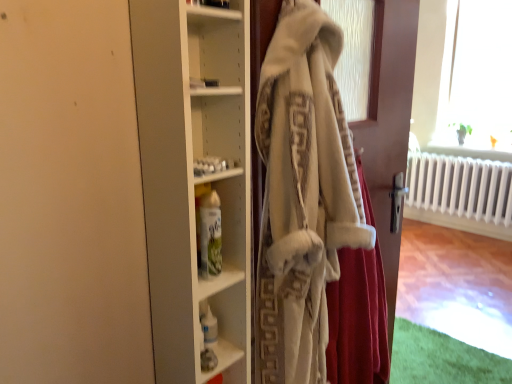
Find the location of `white fluffy bathrobe at center`. white fluffy bathrobe at center is located at coordinates (388, 123).

The width and height of the screenshot is (512, 384). Describe the element at coordinates (388, 123) in the screenshot. I see `white fluffy bathrobe at center` at that location.

Where is `white glossy spray can at center, marked as the 1th shelf in a top-to-bottom arrangement`? The width and height of the screenshot is (512, 384). white glossy spray can at center, marked as the 1th shelf in a top-to-bottom arrangement is located at coordinates (216, 239).

The height and width of the screenshot is (384, 512). I want to click on white matte cupboard at center, so click(194, 175).

Is white matte cupboard at center a part of white plastic bottle at lower center, which is the 1th shelf in back-to-front order?

Actually, white matte cupboard at center is outside white plastic bottle at lower center, which is the 1th shelf in back-to-front order.

From the image's perspective, is white plastic bottle at lower center, which is the 1th shelf in back-to-front order, positioned above or below white matte cupboard at center?

From the image's perspective, white plastic bottle at lower center, which is the 1th shelf in back-to-front order, appears below white matte cupboard at center.

Which is more to the left, white plastic bottle at lower center, which is the 1th shelf in back-to-front order, or white matte cupboard at center?

From the viewer's perspective, white matte cupboard at center appears more on the left side.

Considering the positions of objects white plastic bottle at lower center, which is the 1th shelf in back-to-front order, and white matte cupboard at center in the image provided, who is behind, white plastic bottle at lower center, which is the 1th shelf in back-to-front order, or white matte cupboard at center?

Positioned behind is white plastic bottle at lower center, which is the 1th shelf in back-to-front order.

Which of these two, white glossy spray can at center, marked as the 1th shelf in a top-to-bottom arrangement, or fuzzy white shawl at center, is thinner?

With smaller width is white glossy spray can at center, marked as the 1th shelf in a top-to-bottom arrangement.

Is white glossy spray can at center, positioned as the second shelf in back-to-front order, next to fuzzy white shawl at center?

No, white glossy spray can at center, positioned as the second shelf in back-to-front order, is not making contact with fuzzy white shawl at center.

Is white glossy spray can at center, positioned as the second shelf in back-to-front order, in front of or behind fuzzy white shawl at center in the image?

Clearly, white glossy spray can at center, positioned as the second shelf in back-to-front order, is behind fuzzy white shawl at center.

Between white matte cupboard at center and white plastic bottle at lower center, the 2th shelf positioned from the top, which one has larger width?

white matte cupboard at center.

Is white matte cupboard at center oriented towards white plastic bottle at lower center, which is the 1th shelf in back-to-front order?

No, white matte cupboard at center does not turn towards white plastic bottle at lower center, which is the 1th shelf in back-to-front order.

From a real-world perspective, does white matte cupboard at center sit lower than white plastic bottle at lower center, which is the 1th shelf from bottom to top?

Actually, white matte cupboard at center is physically above white plastic bottle at lower center, which is the 1th shelf from bottom to top, in the real world.

Based on the photo, can you tell me how much white matte cupboard at center and white plastic bottle at lower center, which is the second shelf in front-to-back order, differ in facing direction?

2.33 degrees.

Is the position of white plastic bottle at lower center, which is the second shelf in front-to-back order, more distant than that of white fluffy bathrobe at center?

Yes, it is behind white fluffy bathrobe at center.

Could you tell me if white plastic bottle at lower center, which is the second shelf in front-to-back order, is turned towards white fluffy bathrobe at center?

Yes, white plastic bottle at lower center, which is the second shelf in front-to-back order, is facing white fluffy bathrobe at center.

Can you confirm if white plastic bottle at lower center, the 2th shelf positioned from the top, is shorter than fuzzy white shawl at center?

Yes.

From a real-world perspective, is white plastic bottle at lower center, which is the second shelf in front-to-back order, below fuzzy white shawl at center?

Indeed, from a real-world perspective, white plastic bottle at lower center, which is the second shelf in front-to-back order, is positioned beneath fuzzy white shawl at center.

Considering the positions of points (208, 373) and (345, 252), is point (208, 373) closer to camera compared to point (345, 252)?

Yes, point (208, 373) is closer to viewer.

Could you tell me if white plastic bottle at lower center, which is the 1th shelf from bottom to top, is facing fuzzy white shawl at center?

No, white plastic bottle at lower center, which is the 1th shelf from bottom to top, is not facing towards fuzzy white shawl at center.

I want to click on shelf that is under the white glossy spray can at center, positioned as the second shelf in back-to-front order (from a real-world perspective), so click(222, 358).

From the picture: Considering the positions of objects white glossy spray can at center, marked as the 1th shelf in a top-to-bottom arrangement, and white plastic bottle at lower center, which is the 1th shelf in back-to-front order, in the image provided, who is behind, white glossy spray can at center, marked as the 1th shelf in a top-to-bottom arrangement, or white plastic bottle at lower center, which is the 1th shelf in back-to-front order,?

white plastic bottle at lower center, which is the 1th shelf in back-to-front order, is further away from the camera.

Between white glossy spray can at center, positioned as the second shelf in back-to-front order, and white plastic bottle at lower center, which is the 1th shelf from bottom to top, which one appears on the left side from the viewer's perspective?

white glossy spray can at center, positioned as the second shelf in back-to-front order.

Is white glossy spray can at center, positioned as the second shelf in back-to-front order, spatially inside white plastic bottle at lower center, which is the 1th shelf in back-to-front order, or outside of it?

The correct answer is: outside.

Who is bigger, fuzzy white shawl at center or white fluffy bathrobe at center?

white fluffy bathrobe at center is bigger.

Does fuzzy white shawl at center have a greater width compared to white fluffy bathrobe at center?

No, fuzzy white shawl at center is not wider than white fluffy bathrobe at center.

Between fuzzy white shawl at center and white fluffy bathrobe at center, which one is positioned behind?

fuzzy white shawl at center is more distant.

Is fuzzy white shawl at center inside or outside of white fluffy bathrobe at center?

fuzzy white shawl at center lies within the bounds of white fluffy bathrobe at center.

Locate an element on the screen. The height and width of the screenshot is (384, 512). cupboard that appears above the white plastic bottle at lower center, the 2th shelf positioned from the top (from the image's perspective) is located at coordinates (194, 175).

You are a GUI agent. You are given a task and a screenshot of the screen. Output one action in this format:
    pyautogui.click(x=<x>, y=<y>)
    Task: Click on the shawl below the white glossy spray can at center, positioned as the second shelf in back-to-front order (from a real-world perspective)
    The image size is (512, 384).
    Given the screenshot: What is the action you would take?
    pyautogui.click(x=358, y=320)

Looking at the image, which one is located further to white glossy spray can at center, acting as the 2th shelf starting from the bottom, white plastic bottle at lower center, the 2th shelf positioned from the top, or white fluffy bathrobe at center?

white fluffy bathrobe at center.

When comparing their distances from white matte cupboard at center, does white fluffy bathrobe at center or white plastic bottle at lower center, the 2th shelf positioned from the top, seem closer?

white plastic bottle at lower center, the 2th shelf positioned from the top, lies closer to white matte cupboard at center than the other object.

Based on their spatial positions, is white glossy spray can at center, positioned as the second shelf in back-to-front order, or white fluffy bathrobe at center closer to white matte cupboard at center?

white glossy spray can at center, positioned as the second shelf in back-to-front order, is positioned closer to the anchor white matte cupboard at center.

Looking at the image, which one is located closer to white glossy spray can at center, acting as the 2th shelf starting from the bottom, fuzzy white shawl at center or white matte cupboard at center?

Among the two, white matte cupboard at center is located nearer to white glossy spray can at center, acting as the 2th shelf starting from the bottom.

From the image, which object appears to be farther from white matte cupboard at center, fuzzy white shawl at center or white plastic bottle at lower center, the 2th shelf positioned from the top?

Based on the image, fuzzy white shawl at center appears to be further to white matte cupboard at center.

From the image, which object appears to be nearer to white plastic bottle at lower center, which is the 1th shelf from bottom to top, white matte cupboard at center or white glossy spray can at center, which ranks as the first shelf in front-to-back order?

white glossy spray can at center, which ranks as the first shelf in front-to-back order, lies closer to white plastic bottle at lower center, which is the 1th shelf from bottom to top, than the other object.

From the image, which object appears to be nearer to white plastic bottle at lower center, which is the 1th shelf in back-to-front order, fuzzy white shawl at center or white fluffy bathrobe at center?

Among the two, fuzzy white shawl at center is located nearer to white plastic bottle at lower center, which is the 1th shelf in back-to-front order.

Considering their positions, is white fluffy bathrobe at center positioned further to fuzzy white shawl at center than white plastic bottle at lower center, which is the 1th shelf from bottom to top?

white plastic bottle at lower center, which is the 1th shelf from bottom to top, is positioned further to the anchor fuzzy white shawl at center.

Locate an element on the screen. The width and height of the screenshot is (512, 384). shawl that lies between white matte cupboard at center and white plastic bottle at lower center, the 2th shelf positioned from the top, from top to bottom is located at coordinates pyautogui.click(x=358, y=320).

The width and height of the screenshot is (512, 384). Identify the location of shawl that lies between white fluffy bathrobe at center and white plastic bottle at lower center, the 2th shelf positioned from the top, from top to bottom. (358, 320).

Identify the location of door between white glossy spray can at center, positioned as the second shelf in back-to-front order, and white plastic bottle at lower center, the 2th shelf positioned from the top, in the vertical direction. This screenshot has height=384, width=512. (388, 123).

The height and width of the screenshot is (384, 512). Identify the location of door located between white matte cupboard at center and fuzzy white shawl at center in the left-right direction. (388, 123).